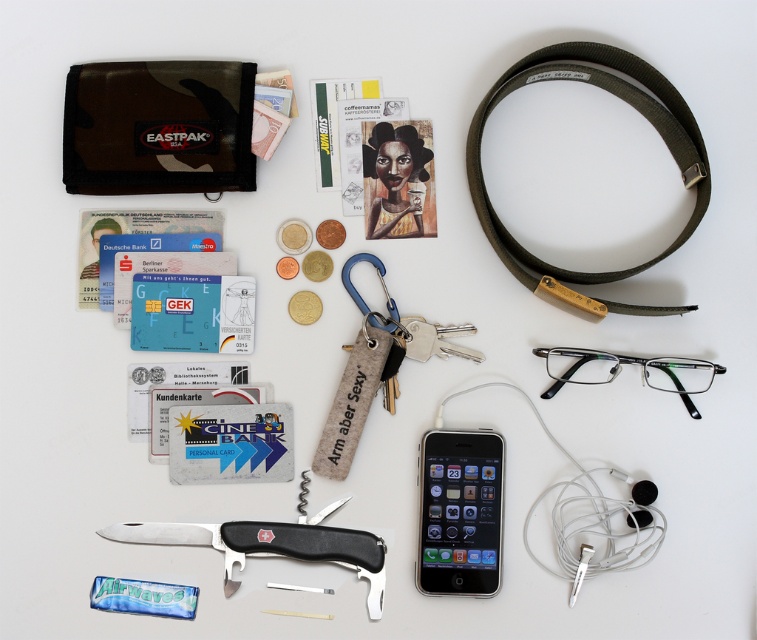
Question: Does olive green fabric strap at upper right appear on the right side of matte black glasses at lower right?

Choices:
 (A) yes
 (B) no

Answer: (B)

Question: Can you confirm if black plastic pocket knife at center is positioned to the right of matte black glasses at lower right?

Choices:
 (A) no
 (B) yes

Answer: (A)

Question: Which object is closer to the camera taking this photo?

Choices:
 (A) silver metallic smartphone at center
 (B) olive green fabric strap at upper right
 (C) matte black glasses at lower right

Answer: (B)

Question: Which point is farther to the camera?

Choices:
 (A) (684, 392)
 (B) (531, 253)
 (C) (432, 461)

Answer: (C)

Question: Which of the following is the closest to the observer?

Choices:
 (A) matte black glasses at lower right
 (B) black plastic pocket knife at center
 (C) silver metallic smartphone at center
 (D) olive green fabric strap at upper right

Answer: (D)

Question: Considering the relative positions of olive green fabric strap at upper right and silver metallic smartphone at center in the image provided, where is olive green fabric strap at upper right located with respect to silver metallic smartphone at center?

Choices:
 (A) left
 (B) right

Answer: (B)